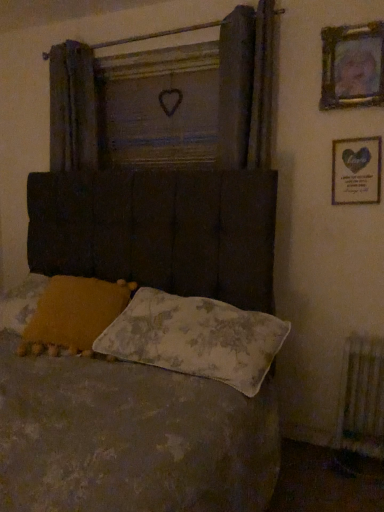
Question: From the image's perspective, relative to dark gray fabric curtain at upper left, is gold-framed picture at upper right, the first picture frame positioned from the top, above or below?

Choices:
 (A) below
 (B) above

Answer: (B)

Question: From a real-world perspective, is gold-framed picture at upper right, the second picture frame in the bottom-to-top sequence, positioned above or below dark gray fabric curtain at upper left?

Choices:
 (A) above
 (B) below

Answer: (A)

Question: Which is farther from the wooden heart at center?

Choices:
 (A) metallic silver frame at upper right, the 1th picture frame from the bottom
 (B) floral fabric pillow at center, positioned as the 2th pillow in left-to-right order
 (C) gold-framed picture at upper right, the first picture frame positioned from the top
 (D) dark gray fabric curtain at upper left
 (E) textured fabric bed at center

Answer: (B)

Question: Based on their relative distances, which object is nearer to the textured fabric bed at center?

Choices:
 (A) dark gray fabric curtain at upper left
 (B) fluffy yellow pillow at lower left, positioned as the 2th pillow in right-to-left order
 (C) wooden heart at center
 (D) gold-framed picture at upper right, the second picture frame in the bottom-to-top sequence
 (E) white textured radiator at lower right

Answer: (B)